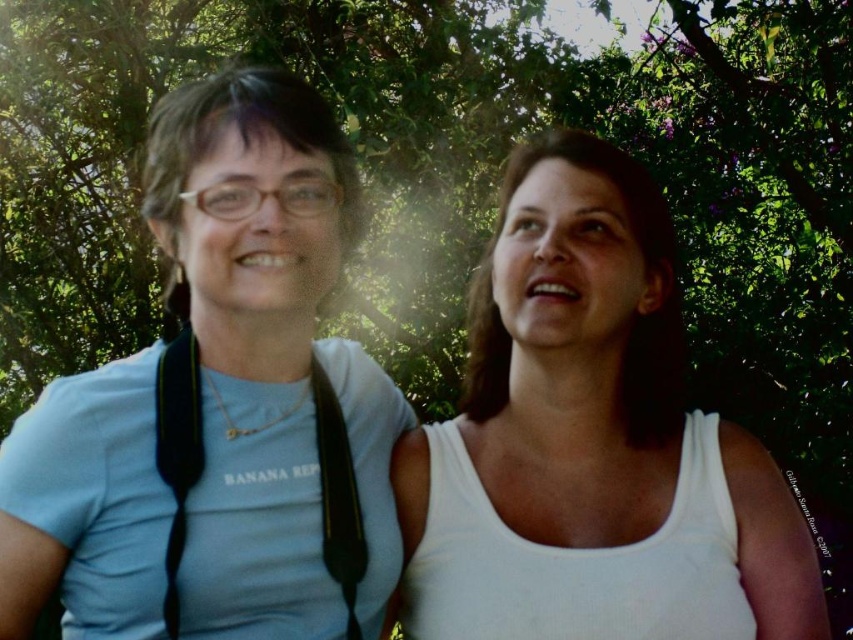
Is light blue t-shirt at left smaller than light blue fabric vest at left?

Incorrect, light blue t-shirt at left is not smaller in size than light blue fabric vest at left.

From the picture: Is light blue t-shirt at left in front of light blue fabric vest at left?

That is True.

Is point (215, 580) more distant than point (196, 392)?

No, it is in front of (196, 392).

Where is `light blue t-shirt at left`? light blue t-shirt at left is located at coordinates (219, 406).

Is light blue t-shirt at left thinner than white matte tank top at center?

Yes, light blue t-shirt at left is thinner than white matte tank top at center.

Is point (352, 356) behind point (653, 188)?

Yes.

At what (x,y) coordinates should I click in order to perform the action: click on light blue t-shirt at left. Please return your answer as a coordinate pair (x, y). Looking at the image, I should click on (219, 406).

Between point (628, 508) and point (332, 458), which one is positioned behind?

The point (628, 508) is more distant.

Is point (610, 403) positioned in front of point (341, 497)?

No, (610, 403) is further to viewer.

Locate an element on the screen. white matte tank top at center is located at coordinates (576, 352).